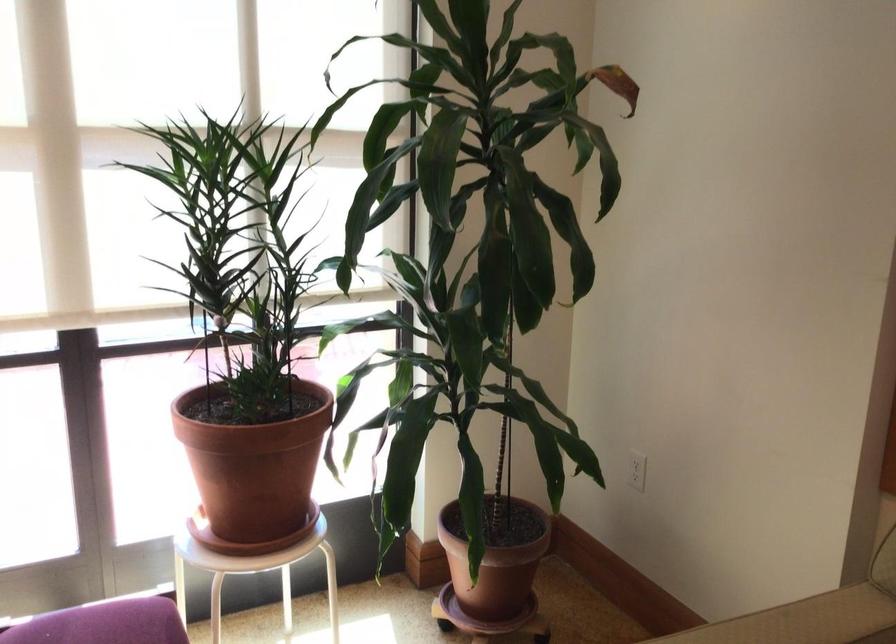
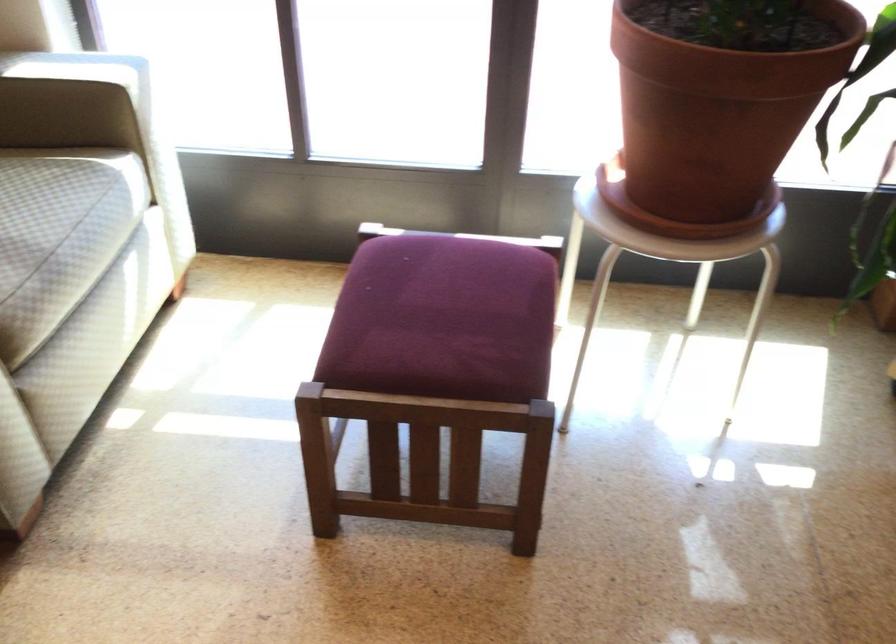
Question: I am providing you with two images of the same scene from different viewpoints. After the viewpoint changes to image2, which objects are now occluded?

Choices:
 (A) chair sitting surface
 (B) white metal stool
 (C) sofa sitting surface
 (D) none of these

Answer: (D)